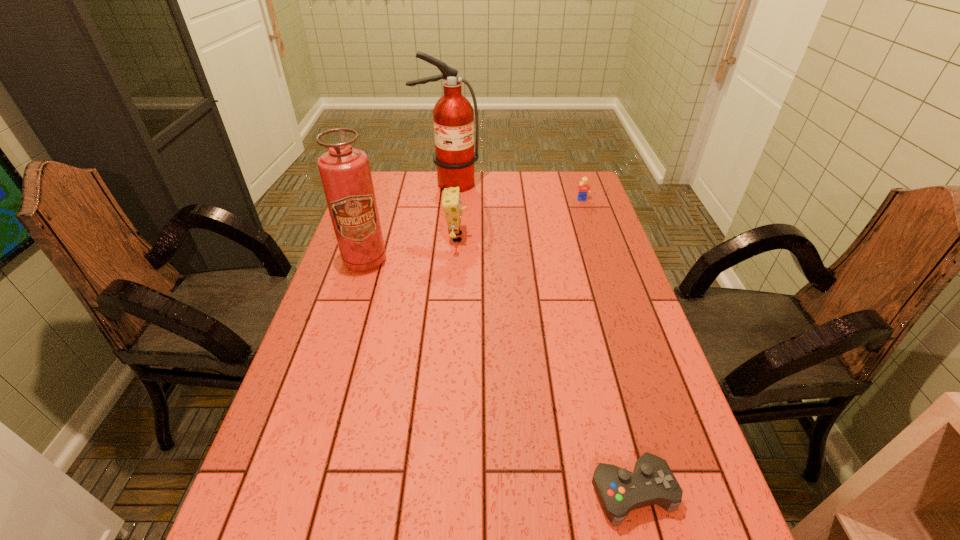
The image size is (960, 540). Identify the location of free point at the far edge. (505, 181).

In order to click on vacant point at the left edge in this screenshot , I will do `click(313, 371)`.

You are a GUI agent. You are given a task and a screenshot of the screen. Output one action in this format:
    pyautogui.click(x=<x>, y=<y>)
    Task: Click on the vacant area at the right edge
    
    Given the screenshot: What is the action you would take?
    pyautogui.click(x=689, y=498)

The height and width of the screenshot is (540, 960). In the image, there is a desktop. Find the location of `vacant space at the far right corner`. vacant space at the far right corner is located at coordinates (595, 190).

The width and height of the screenshot is (960, 540). In order to click on empty space between the nearest object and the shorter fire extinguisher in this screenshot , I will do `click(498, 376)`.

The height and width of the screenshot is (540, 960). Find the location of `vacant space that is in between the control and the tallest object`. vacant space that is in between the control and the tallest object is located at coordinates (540, 338).

Where is `empty space between the fourth nearest object and the sponge`? This screenshot has height=540, width=960. empty space between the fourth nearest object and the sponge is located at coordinates (519, 219).

Identify the location of blank region between the fourth nearest object and the farthest object. (515, 192).

This screenshot has height=540, width=960. I want to click on free space between the shorter fire extinguisher and the third tallest object, so click(411, 249).

You are a GUI agent. You are given a task and a screenshot of the screen. Output one action in this format:
    pyautogui.click(x=<x>, y=<y>)
    Task: Click on the free point between the sponge and the fourth tallest object
    This screenshot has width=960, height=540.
    Given the screenshot: What is the action you would take?
    pyautogui.click(x=519, y=219)